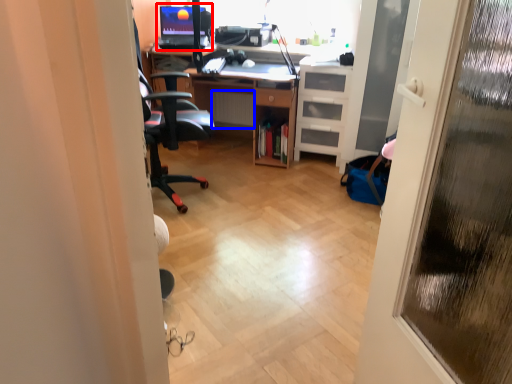
Question: Among these objects, which one is nearest to the camera, desktop computer (highlighted by a red box) or radiator (highlighted by a blue box)?

Choices:
 (A) desktop computer
 (B) radiator

Answer: (A)